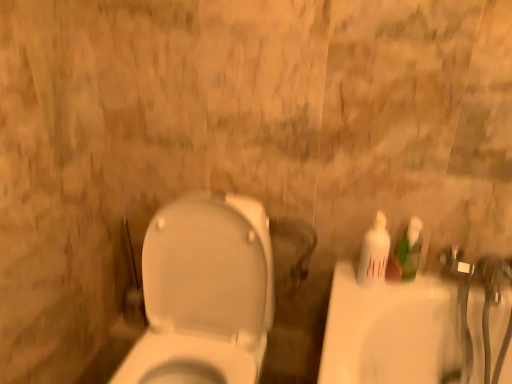
What is the approximate width of white glossy bottle at right, arranged as the second mouthwash when viewed from the right?

The width of white glossy bottle at right, arranged as the second mouthwash when viewed from the right, is 6.47 centimeters.

Image resolution: width=512 pixels, height=384 pixels. I want to click on white glossy bottle at right, acting as the first mouthwash starting from the left, so click(374, 252).

This screenshot has width=512, height=384. In order to click on green plastic bottle at right, which appears as the second mouthwash when viewed from the left in this screenshot , I will do `click(410, 249)`.

Describe the element at coordinates (204, 294) in the screenshot. I see `white glossy toilet at center` at that location.

Image resolution: width=512 pixels, height=384 pixels. I want to click on white glossy toilet at center, so click(204, 294).

This screenshot has width=512, height=384. Identify the location of white glossy bottle at right, acting as the first mouthwash starting from the left. (374, 252).

Is white glossy bottle at right, acting as the first mouthwash starting from the left, to the left or to the right of white glossy toilet at center in the image?

Clearly, white glossy bottle at right, acting as the first mouthwash starting from the left, is on the right of white glossy toilet at center in the image.

Is point (372, 265) less distant than point (247, 239)?

No, (372, 265) is behind (247, 239).

Which object is further away from the camera taking this photo, white glossy bottle at right, acting as the first mouthwash starting from the left, or white glossy toilet at center?

white glossy bottle at right, acting as the first mouthwash starting from the left, is behind.

Is white glossy bottle at right, arranged as the second mouthwash when viewed from the right, beside white glossy toilet at center?

No.

From the picture: From the image's perspective, which one is positioned higher, white glossy toilet at center or white glossy bottle at right, acting as the first mouthwash starting from the left?

white glossy bottle at right, acting as the first mouthwash starting from the left, is shown above in the image.

Is white glossy toilet at center bigger than white glossy bottle at right, arranged as the second mouthwash when viewed from the right?

Correct, white glossy toilet at center is larger in size than white glossy bottle at right, arranged as the second mouthwash when viewed from the right.

From a real-world perspective, does white glossy toilet at center sit lower than white glossy bottle at right, arranged as the second mouthwash when viewed from the right?

Indeed, from a real-world perspective, white glossy toilet at center is positioned beneath white glossy bottle at right, arranged as the second mouthwash when viewed from the right.

Can you confirm if white glossy toilet at center is positioned to the left of white glossy bottle at right, arranged as the second mouthwash when viewed from the right?

Correct, you'll find white glossy toilet at center to the left of white glossy bottle at right, arranged as the second mouthwash when viewed from the right.

From a real-world perspective, who is located higher, white glossy bottle at right, acting as the first mouthwash starting from the left, or green plastic bottle at right, which appears as the second mouthwash when viewed from the left?

white glossy bottle at right, acting as the first mouthwash starting from the left, is physically above.

Which of these two, white glossy bottle at right, arranged as the second mouthwash when viewed from the right, or green plastic bottle at right, marked as the 1th mouthwash in a right-to-left arrangement, is wider?

With larger width is white glossy bottle at right, arranged as the second mouthwash when viewed from the right.

Considering the sizes of objects white glossy bottle at right, acting as the first mouthwash starting from the left, and green plastic bottle at right, marked as the 1th mouthwash in a right-to-left arrangement, in the image provided, who is taller, white glossy bottle at right, acting as the first mouthwash starting from the left, or green plastic bottle at right, marked as the 1th mouthwash in a right-to-left arrangement,?

green plastic bottle at right, marked as the 1th mouthwash in a right-to-left arrangement, is taller.

Image resolution: width=512 pixels, height=384 pixels. Identify the location of the 2nd mouthwash to the right when counting from the white glossy toilet at center. (410, 249).

Would you say white glossy toilet at center is a long distance from green plastic bottle at right, marked as the 1th mouthwash in a right-to-left arrangement?

No, there isn't a large distance between white glossy toilet at center and green plastic bottle at right, marked as the 1th mouthwash in a right-to-left arrangement.

Is white glossy toilet at center taller or shorter than green plastic bottle at right, marked as the 1th mouthwash in a right-to-left arrangement?

In the image, white glossy toilet at center appears to be taller than green plastic bottle at right, marked as the 1th mouthwash in a right-to-left arrangement.

Is white glossy toilet at center aimed at green plastic bottle at right, marked as the 1th mouthwash in a right-to-left arrangement?

No, white glossy toilet at center is not facing towards green plastic bottle at right, marked as the 1th mouthwash in a right-to-left arrangement.

Does green plastic bottle at right, marked as the 1th mouthwash in a right-to-left arrangement, have a smaller size compared to white glossy bottle at right, acting as the first mouthwash starting from the left?

Yes, green plastic bottle at right, marked as the 1th mouthwash in a right-to-left arrangement, is smaller than white glossy bottle at right, acting as the first mouthwash starting from the left.

Can you tell me how much green plastic bottle at right, marked as the 1th mouthwash in a right-to-left arrangement, and white glossy bottle at right, arranged as the second mouthwash when viewed from the right, differ in facing direction?

They differ by 28.6 degrees in their facing directions.

In the scene shown: Between green plastic bottle at right, which appears as the second mouthwash when viewed from the left, and white glossy bottle at right, acting as the first mouthwash starting from the left, which one has more height?

white glossy bottle at right, acting as the first mouthwash starting from the left, is taller.

From a real-world perspective, does green plastic bottle at right, which appears as the second mouthwash when viewed from the left, sit lower than white glossy bottle at right, arranged as the second mouthwash when viewed from the right?

Indeed, from a real-world perspective, green plastic bottle at right, which appears as the second mouthwash when viewed from the left, is positioned beneath white glossy bottle at right, arranged as the second mouthwash when viewed from the right.

Between green plastic bottle at right, which appears as the second mouthwash when viewed from the left, and white glossy toilet at center, which one is positioned in front?

white glossy toilet at center is in front.

From a real-world perspective, is green plastic bottle at right, marked as the 1th mouthwash in a right-to-left arrangement, located higher than white glossy toilet at center?

Correct, in the physical world, green plastic bottle at right, marked as the 1th mouthwash in a right-to-left arrangement, is higher than white glossy toilet at center.

Between green plastic bottle at right, which appears as the second mouthwash when viewed from the left, and white glossy toilet at center, which one has more height?

Standing taller between the two is white glossy toilet at center.

Does green plastic bottle at right, marked as the 1th mouthwash in a right-to-left arrangement, turn towards white glossy toilet at center?

No, green plastic bottle at right, marked as the 1th mouthwash in a right-to-left arrangement, is not facing towards white glossy toilet at center.

Where is `the 2nd mouthwash positioned above the white glossy toilet at center (from a real-world perspective)`? Image resolution: width=512 pixels, height=384 pixels. the 2nd mouthwash positioned above the white glossy toilet at center (from a real-world perspective) is located at coordinates (374, 252).

Where is `toilet below the white glossy bottle at right, acting as the first mouthwash starting from the left (from the image's perspective)`? toilet below the white glossy bottle at right, acting as the first mouthwash starting from the left (from the image's perspective) is located at coordinates (204, 294).

Based on their spatial positions, is white glossy toilet at center or green plastic bottle at right, marked as the 1th mouthwash in a right-to-left arrangement, further from white glossy bottle at right, acting as the first mouthwash starting from the left?

Among the two, white glossy toilet at center is located further to white glossy bottle at right, acting as the first mouthwash starting from the left.

Estimate the real-world distances between objects in this image. Which object is further from green plastic bottle at right, marked as the 1th mouthwash in a right-to-left arrangement, white glossy bottle at right, acting as the first mouthwash starting from the left, or white glossy toilet at center?

white glossy toilet at center is positioned further to the anchor green plastic bottle at right, marked as the 1th mouthwash in a right-to-left arrangement.

When comparing their distances from white glossy toilet at center, does white glossy bottle at right, acting as the first mouthwash starting from the left, or green plastic bottle at right, marked as the 1th mouthwash in a right-to-left arrangement, seem further?

Among the two, green plastic bottle at right, marked as the 1th mouthwash in a right-to-left arrangement, is located further to white glossy toilet at center.

Estimate the real-world distances between objects in this image. Which object is closer to green plastic bottle at right, which appears as the second mouthwash when viewed from the left, white glossy toilet at center or white glossy bottle at right, acting as the first mouthwash starting from the left?

white glossy bottle at right, acting as the first mouthwash starting from the left.

Estimate the real-world distances between objects in this image. Which object is closer to white glossy toilet at center, green plastic bottle at right, which appears as the second mouthwash when viewed from the left, or white glossy bottle at right, acting as the first mouthwash starting from the left?

Based on the image, white glossy bottle at right, acting as the first mouthwash starting from the left, appears to be nearer to white glossy toilet at center.

Which object lies further to the anchor point white glossy bottle at right, arranged as the second mouthwash when viewed from the right, green plastic bottle at right, which appears as the second mouthwash when viewed from the left, or white glossy toilet at center?

The object further to white glossy bottle at right, arranged as the second mouthwash when viewed from the right, is white glossy toilet at center.

Locate an element on the screen. Image resolution: width=512 pixels, height=384 pixels. mouthwash between white glossy toilet at center and green plastic bottle at right, marked as the 1th mouthwash in a right-to-left arrangement, in the horizontal direction is located at coordinates (374, 252).